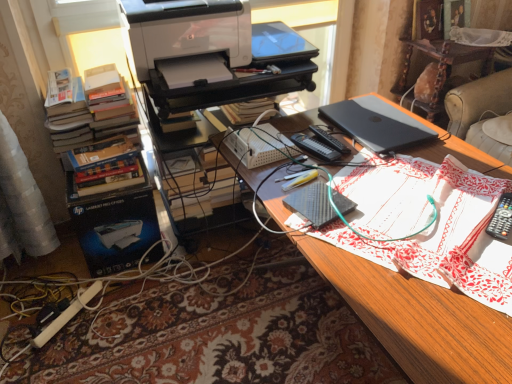
At what (x,y) coordinates should I click in order to perform the action: click on vacant region to the left of black matte laptop at upper right. Please return your answer as a coordinate pair (x, y). Image resolution: width=512 pixels, height=384 pixels. Looking at the image, I should click on click(x=308, y=137).